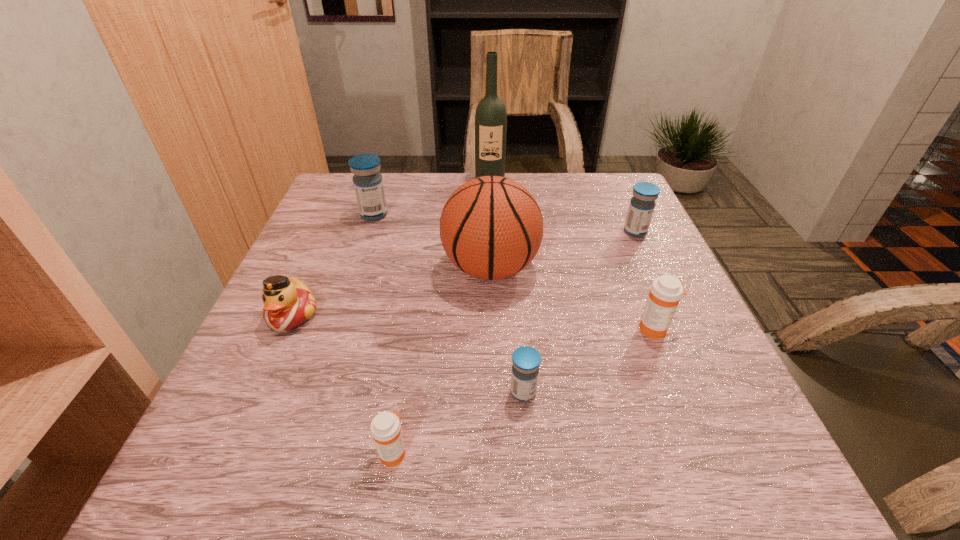
Find the location of `duck`. duck is located at coordinates point(288,303).

Locate an element on the screen. Image resolution: width=960 pixels, height=540 pixels. the leftmost object is located at coordinates click(288, 303).

In order to click on the third object from left to right in this screenshot , I will do `click(385, 428)`.

Find the location of a particular element. Image resolution: width=960 pixels, height=540 pixels. the nearest medicine is located at coordinates [x=385, y=428].

Locate an element on the screen. the nearest blue medicine is located at coordinates (526, 360).

Where is `the third medicine from left to right`? The height and width of the screenshot is (540, 960). the third medicine from left to right is located at coordinates (526, 360).

Where is `vacant area situated 0.200m on the labeled side of the wine bottle`? vacant area situated 0.200m on the labeled side of the wine bottle is located at coordinates tap(492, 227).

What are the coordinates of `free space located on the side where the inflation valve is located` in the screenshot? It's located at (415, 268).

Image resolution: width=960 pixels, height=540 pixels. I want to click on vacant space situated on the side where the inflation valve is located, so click(x=396, y=268).

You are a GUI agent. You are given a task and a screenshot of the screen. Output one action in this format:
    pyautogui.click(x=<x>, y=<y>)
    Task: Click on the vacant space located 0.160m on the side where the inflation valve is located
    
    Given the screenshot: What is the action you would take?
    pyautogui.click(x=370, y=268)